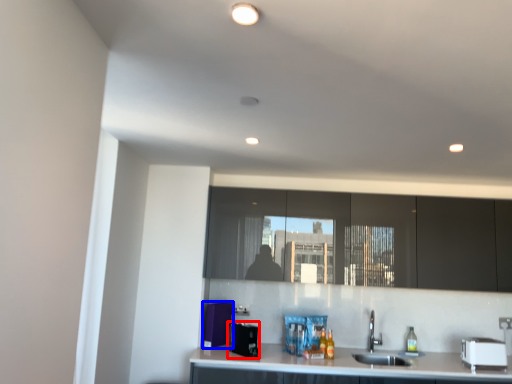
Question: Which object appears closest to the camera in this image, appliance (highlighted by a red box) or appliance (highlighted by a blue box)?

Choices:
 (A) appliance
 (B) appliance

Answer: (A)